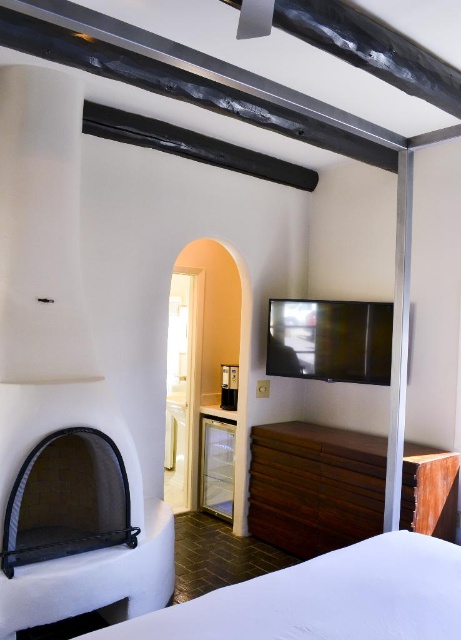
Does white soft bed at lower right have a larger size compared to dark brown wood dresser at center?

Incorrect, white soft bed at lower right is not larger than dark brown wood dresser at center.

Which is below, white soft bed at lower right or dark brown wood dresser at center?

Positioned lower is dark brown wood dresser at center.

Measure the distance between point (236, 584) and camera.

Point (236, 584) and camera are 3.19 meters apart.

The height and width of the screenshot is (640, 461). Identify the location of white soft bed at lower right. (325, 598).

Looking at this image, can you confirm if dark brown wood dresser at center is thinner than black mesh fireplace at lower left?

No, dark brown wood dresser at center is not thinner than black mesh fireplace at lower left.

Is point (343, 445) behind point (112, 522)?

Yes, it is.

At what (x,y) coordinates should I click in order to perform the action: click on dark brown wood dresser at center. Please return your answer as a coordinate pair (x, y). Looking at the image, I should click on (314, 486).

Measure the distance from white soft bed at lower right to black mesh fireplace at lower left.

1.22 meters

Does white soft bed at lower right have a greater height compared to black mesh fireplace at lower left?

In fact, white soft bed at lower right may be shorter than black mesh fireplace at lower left.

What are the coordinates of `white soft bed at lower right` in the screenshot? It's located at (325, 598).

Locate an element on the screen. white soft bed at lower right is located at coordinates (325, 598).